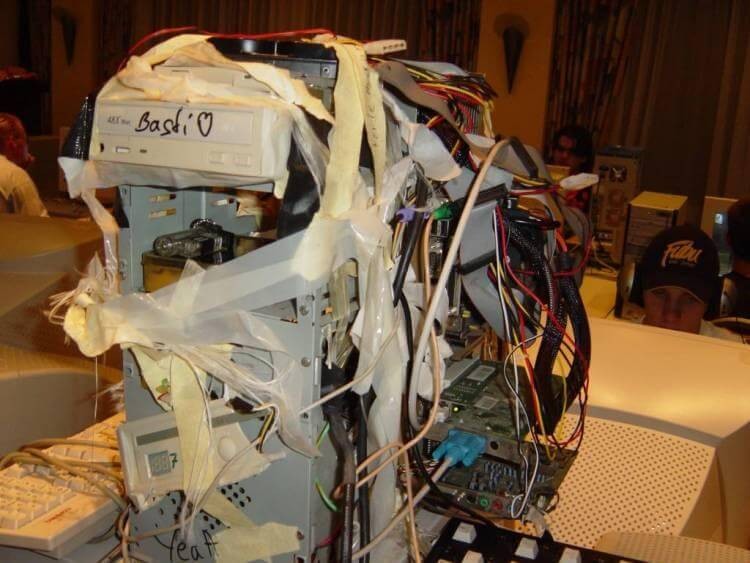
Locate an element on the screen. Image resolution: width=750 pixels, height=563 pixels. computer is located at coordinates (674, 369), (720, 218).